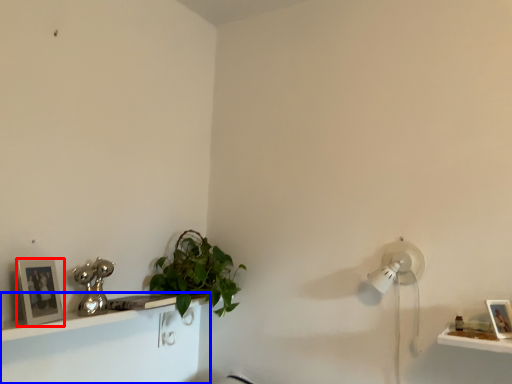
Question: Which object is further to the camera taking this photo, picture frame (highlighted by a red box) or shelf (highlighted by a blue box)?

Choices:
 (A) picture frame
 (B) shelf

Answer: (A)